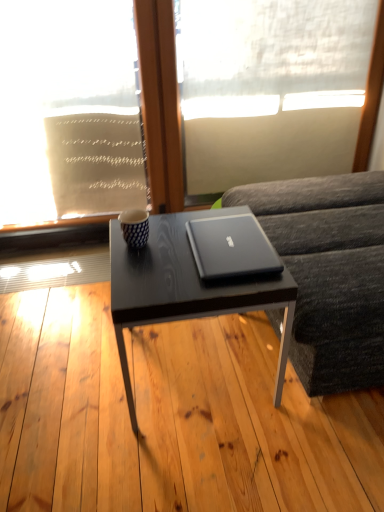
Question: Considering the positions of white sheer fabric at upper left, acting as the 1th window screen starting from the left, and satin black laptop at center in the image, is white sheer fabric at upper left, acting as the 1th window screen starting from the left, bigger or smaller than satin black laptop at center?

Choices:
 (A) small
 (B) big

Answer: (B)

Question: Relative to satin black laptop at center, is white sheer fabric at upper left, acting as the 1th window screen starting from the left, in front or behind?

Choices:
 (A) behind
 (B) front

Answer: (A)

Question: Estimate the real-world distances between objects in this image. Which object is farther from the blue and white textured mug at center?

Choices:
 (A) matte black table at center
 (B) satin black laptop at center
 (C) white sheer fabric at upper left, acting as the 1th window screen starting from the left
 (D) white sheer fabric at upper center, the first window screen from the right
 (E) dark gray fabric couch at right

Answer: (D)

Question: Estimate the real-world distances between objects in this image. Which object is farther from the white sheer fabric at upper left, the 2th window screen in the right-to-left sequence?

Choices:
 (A) satin black laptop at center
 (B) dark gray fabric couch at right
 (C) matte black table at center
 (D) blue and white textured mug at center
 (E) matte black coffee table at center

Answer: (A)